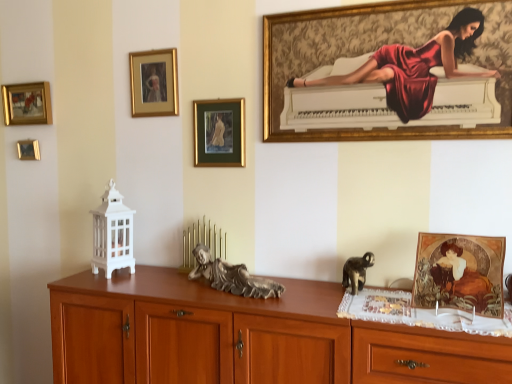
Where is `free location to the left of silver metallic statue at center, the 2th animal in the right-to-left sequence`? This screenshot has height=384, width=512. free location to the left of silver metallic statue at center, the 2th animal in the right-to-left sequence is located at coordinates (166, 288).